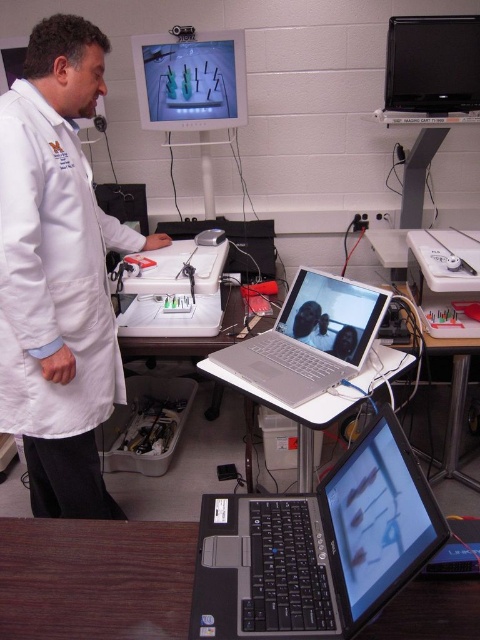
You are a delivery robot with a package that needs to be placed on the desk. The desk has a white lab coat at center and a camera. Which object should you avoid placing the package near to ensure it doesn

The camera is 1.24 meters away from the white lab coat at center. To ensure the package is placed safely, avoid the camera as it might interfere with its operation.

You are a researcher who needs to place a new device on the desk. The device requires a surface that is thicker than the black matte laptop at lower center. Can you use the wooden table at lower left for this purpose?

The wooden table at lower left is thicker than the black matte laptop at lower center, so yes, the wooden table at lower left can be used as the surface for the device since it meets the thickness requirement.

You are a researcher in the lab and need to place a new equipment box that is 1.2 meters wide on the desk. The desk has the white lab coat at center and the silver metallic laptop at center. Can you fit the box between these two items?

The white lab coat at center is larger in size than the silver metallic laptop at center, but the description does not provide specific measurements of the distance between them. Therefore, it is uncertain if the 1.2 meter wide equipment box can fit between them.